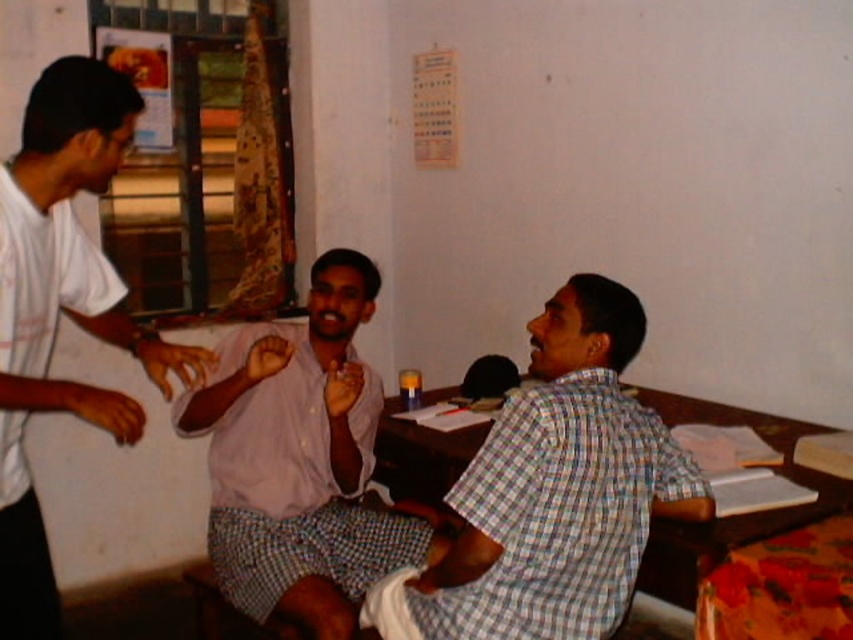
You are trying to decide which object in the scene is bigger between the light pink shirt at center and the wooden at right. Based on the scene description, can you determine which one is larger?

The light pink shirt at center is larger in size than wooden at right according to the description.

You are a photographer setting up for a group photo. You need to position your camera so that both the white cotton shirt at left and the wooden at right are in frame. Based on their positions, which object should you focus on first to ensure both are visible?

The white cotton shirt at left is located above the wooden at right, so you should focus on the white cotton shirt at left first to ensure both are visible in the frame.

You are a delivery person who needs to place a small package between the light pink shirt at center and the wooden at right. The package is 1 meter long. Can you fit it in the space between them?

The distance between the light pink shirt at center and the wooden at right is 93.90 centimeters. Since the package is 1 meter long, which is longer than the available space, it cannot be placed between them.